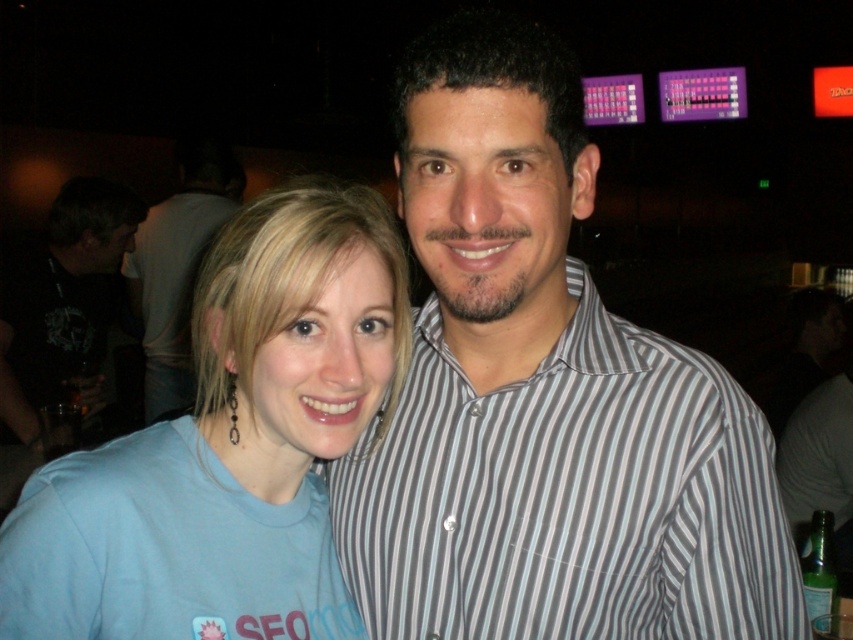
Which is in front, point (341, 209) or point (61, 376)?

Point (341, 209) is more forward.

Does point (368, 236) come behind point (68, 257)?

No, it is in front of (68, 257).

Is point (241, 253) positioned behind point (49, 225)?

No, it is not.

Locate an element on the screen. light blue t-shirt at center is located at coordinates (229, 445).

Does striped cotton shirt at center appear on the right side of light blue t-shirt at center?

Correct, you'll find striped cotton shirt at center to the right of light blue t-shirt at center.

Is point (497, 484) positioned in front of point (202, 417)?

Yes, it is in front of point (202, 417).

Does point (772, 582) come farther from viewer compared to point (241, 486)?

Yes, it is.

Identify the location of striped cotton shirt at center. Image resolution: width=853 pixels, height=640 pixels. 569,497.

Is striped cotton shirt at center shorter than black matte shirt at left?

Yes.

Does striped cotton shirt at center appear on the left side of black matte shirt at left?

No, striped cotton shirt at center is not to the left of black matte shirt at left.

Who is more distant from viewer, (677,499) or (62,220)?

The point (62,220) is more distant.

Image resolution: width=853 pixels, height=640 pixels. Find the location of `striped cotton shirt at center`. striped cotton shirt at center is located at coordinates (569, 497).